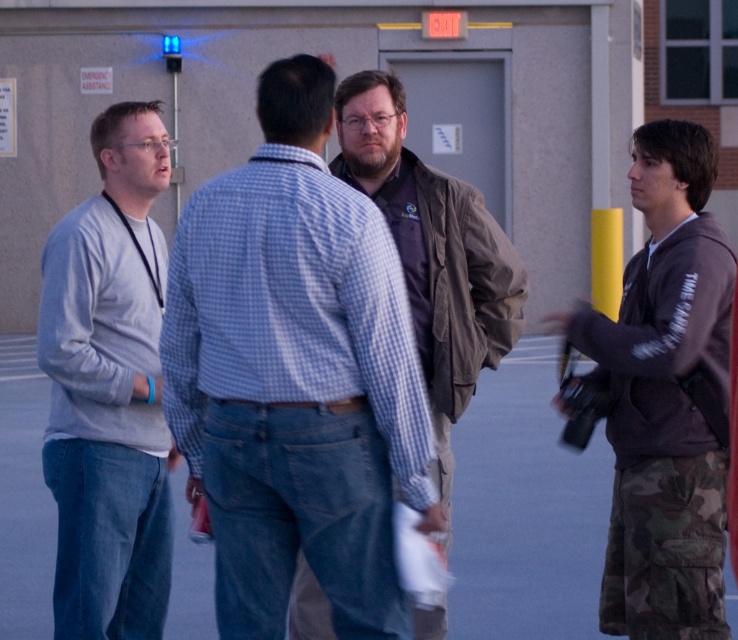
Find the location of a particular element. This screenshot has width=738, height=640. blue checkered shirt at center is located at coordinates (294, 376).

Between blue checkered shirt at center and light gray sweater at left, which one has more height?

With more height is light gray sweater at left.

The image size is (738, 640). What do you see at coordinates (294, 376) in the screenshot?
I see `blue checkered shirt at center` at bounding box center [294, 376].

Image resolution: width=738 pixels, height=640 pixels. I want to click on blue checkered shirt at center, so click(x=294, y=376).

Looking at this image, between blue checkered shirt at center and camouflage pants at right, which one has less height?

blue checkered shirt at center is shorter.

Is blue checkered shirt at center to the right of camouflage pants at right from the viewer's perspective?

Incorrect, blue checkered shirt at center is not on the right side of camouflage pants at right.

This screenshot has height=640, width=738. Find the location of `blue checkered shirt at center`. blue checkered shirt at center is located at coordinates (294, 376).

Is camouflage pants at right smaller than brown fabric jacket at center?

Yes, camouflage pants at right is smaller than brown fabric jacket at center.

Who is more distant from viewer, [606,348] or [437,442]?

The point [437,442] is behind.

Image resolution: width=738 pixels, height=640 pixels. Find the location of `camouflage pants at right`. camouflage pants at right is located at coordinates (665, 396).